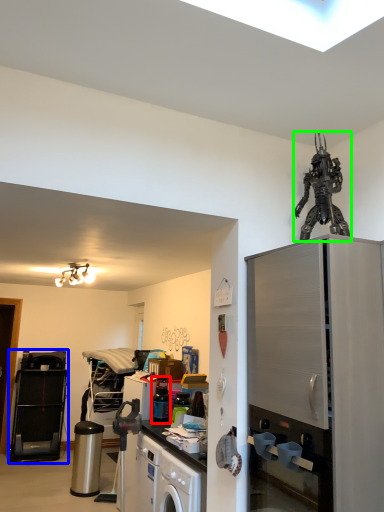
Question: Which object is positioned farthest from appliance (highlighted by a red box)? Select from appliance (highlighted by a blue box) and toy (highlighted by a green box).

Choices:
 (A) appliance
 (B) toy

Answer: (A)